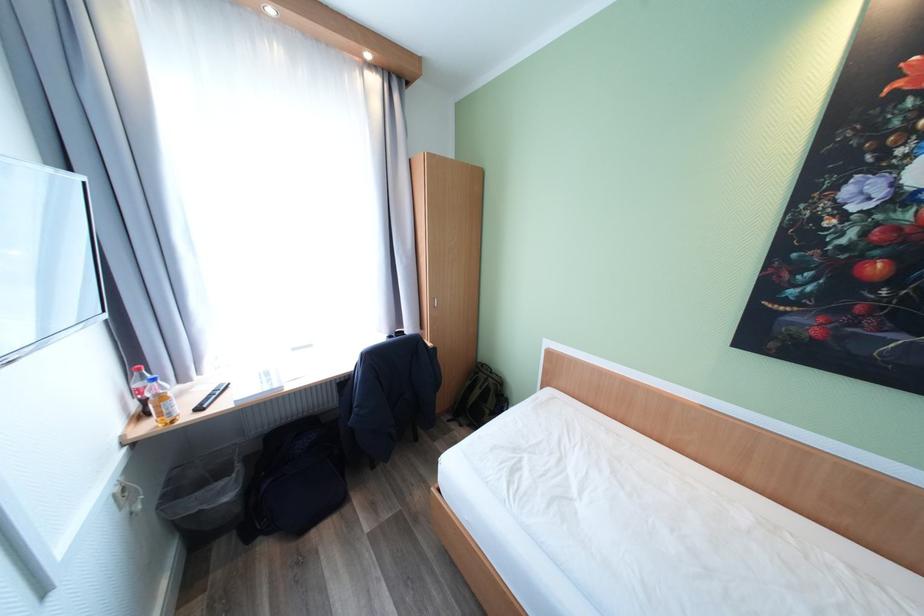
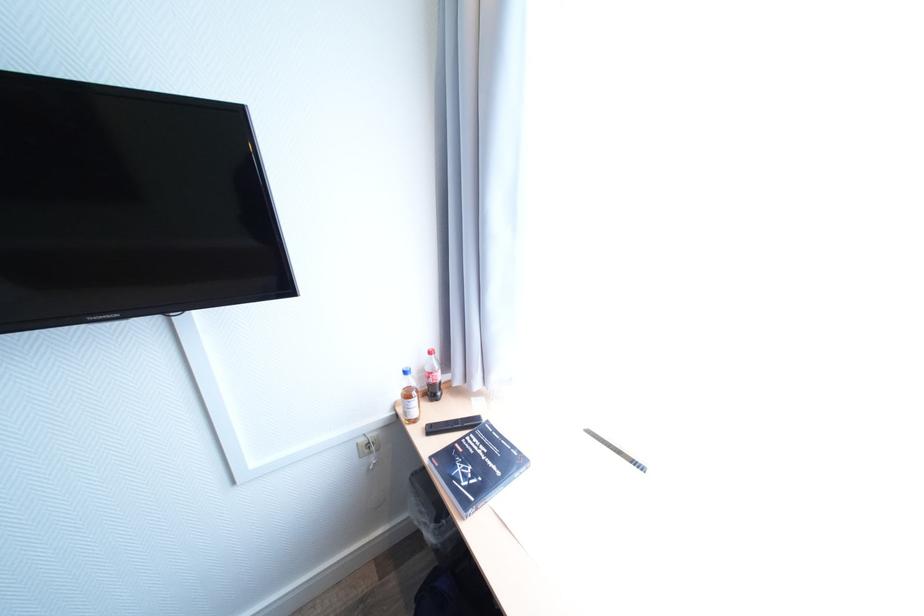
Where in the second image is the point corresponding to (207,410) from the first image?

(439, 430)